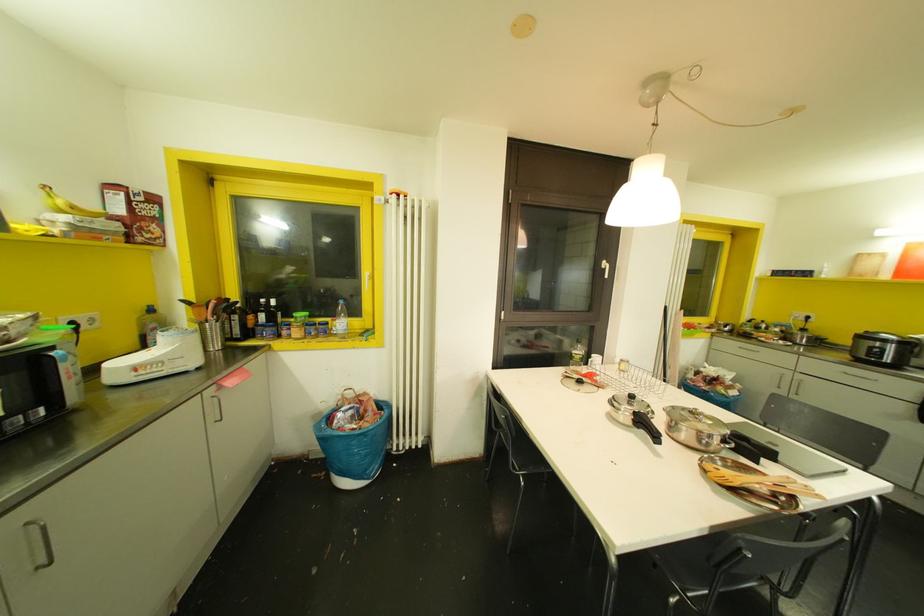
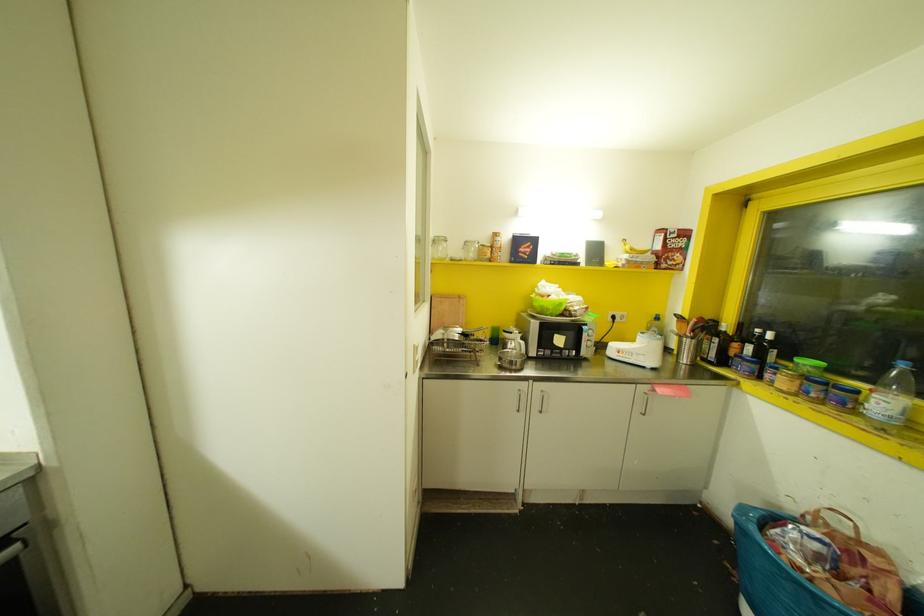
In the second image, find the point that corresponds to (x=284, y=331) in the first image.

(767, 375)